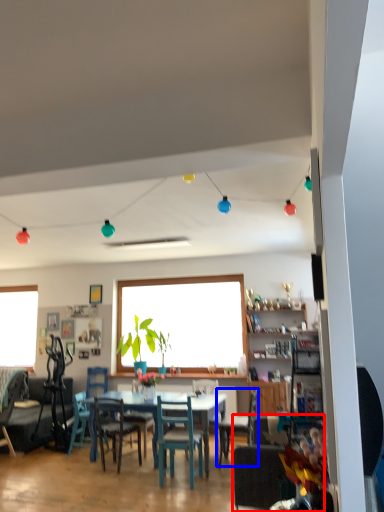
Question: Among these objects, which one is farthest to the camera, chair (highlighted by a red box) or chair (highlighted by a blue box)?

Choices:
 (A) chair
 (B) chair

Answer: (B)